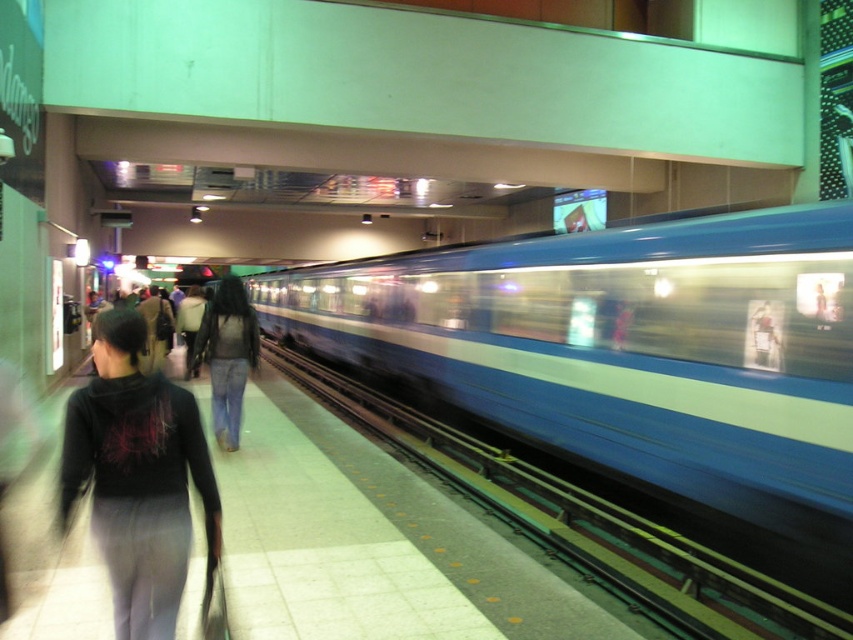
You are standing at the subway station and see the point marked at coordinates (x=138, y=477). What object is located at this point?

The point at (x=138, y=477) corresponds to the dark gray sweatpants at lower left.

You are standing at the subway station and see the dark gray sweatpants at lower left. Where exactly are they located in the scene?

The dark gray sweatpants at lower left are located at point (138,477) in the scene.